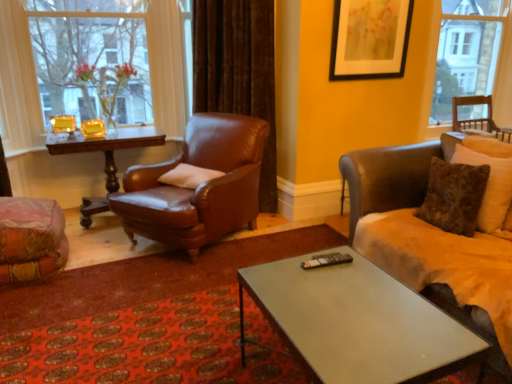
Question: Considering the positions of wooden chair at right, acting as the first window starting from the right, and velvet orange chair at lower left, positioned as the 1th chair in left-to-right order, in the image, is wooden chair at right, acting as the first window starting from the right, taller or shorter than velvet orange chair at lower left, positioned as the 1th chair in left-to-right order,?

Choices:
 (A) short
 (B) tall

Answer: (B)

Question: Considering the positions of point (492, 64) and point (24, 263), is point (492, 64) closer or farther from the camera than point (24, 263)?

Choices:
 (A) farther
 (B) closer

Answer: (A)

Question: Which of these objects is positioned farthest from the brown velvet curtain at upper center?

Choices:
 (A) wooden polished table at left
 (B) white soft pillow at center
 (C) black plastic remote control at center
 (D) metallic gray coffee table at center
 (E) wooden chair at right, acting as the first window starting from the right

Answer: (E)

Question: Which object is the farthest from the white soft pillow at center?

Choices:
 (A) clear glass vase at upper left, the second window in the right-to-left sequence
 (B) wooden chair at right, acting as the first window starting from the right
 (C) matte black picture frame at upper center
 (D) brown leather chair at center, the 3th chair viewed from the right
 (E) wooden polished table at left

Answer: (B)